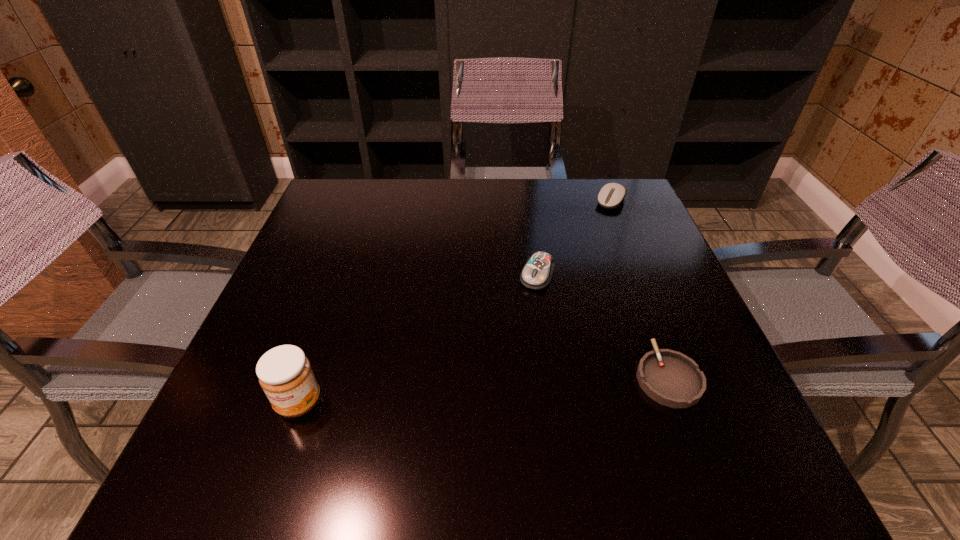
Where is `free space located on the wheel side of the right computer mouse`? This screenshot has width=960, height=540. free space located on the wheel side of the right computer mouse is located at coordinates (566, 261).

Find the location of `vacant space located on the wheel side of the nearer computer mouse`. vacant space located on the wheel side of the nearer computer mouse is located at coordinates (468, 423).

You are a GUI agent. You are given a task and a screenshot of the screen. Output one action in this format:
    pyautogui.click(x=<x>, y=<y>)
    Task: Click on the vacant space located 0.340m on the wheel side of the nearer computer mouse
    This screenshot has height=540, width=960.
    Given the screenshot: What is the action you would take?
    pyautogui.click(x=469, y=418)

Find the location of a particular element. This screenshot has height=540, width=960. free space located on the wheel side of the nearer computer mouse is located at coordinates (507, 342).

The image size is (960, 540). I want to click on object at the far edge, so click(611, 195).

You are a GUI agent. You are given a task and a screenshot of the screen. Output one action in this format:
    pyautogui.click(x=<x>, y=<y>)
    Task: Click on the jam that is at the near edge
    The image size is (960, 540).
    Given the screenshot: What is the action you would take?
    pyautogui.click(x=284, y=372)

Image resolution: width=960 pixels, height=540 pixels. What are the coordinates of `ashtray that is at the near edge` in the screenshot? It's located at (672, 379).

Locate an element on the screen. The image size is (960, 540). object present at the left edge is located at coordinates 284,372.

Locate an element on the screen. This screenshot has width=960, height=540. ashtray that is at the right edge is located at coordinates click(x=672, y=379).

At what (x,y) coordinates should I click in order to perform the action: click on computer equipment that is at the right edge. Please return your answer as a coordinate pair (x, y). Looking at the image, I should click on (611, 195).